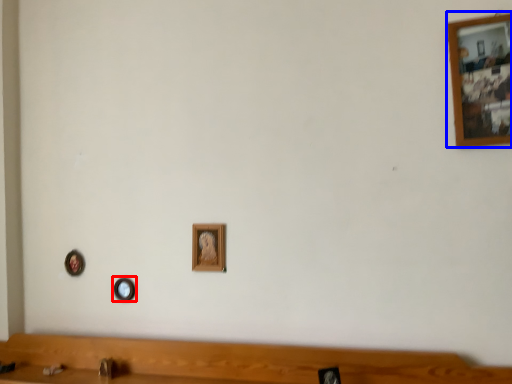
Question: Among these objects, which one is farthest to the camera, picture frame (highlighted by a red box) or picture frame (highlighted by a blue box)?

Choices:
 (A) picture frame
 (B) picture frame

Answer: (A)